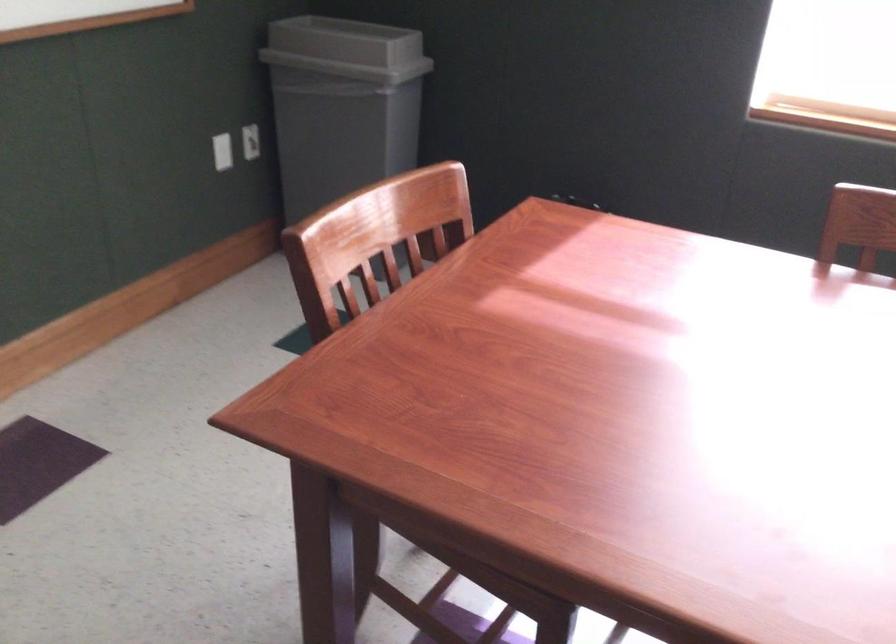
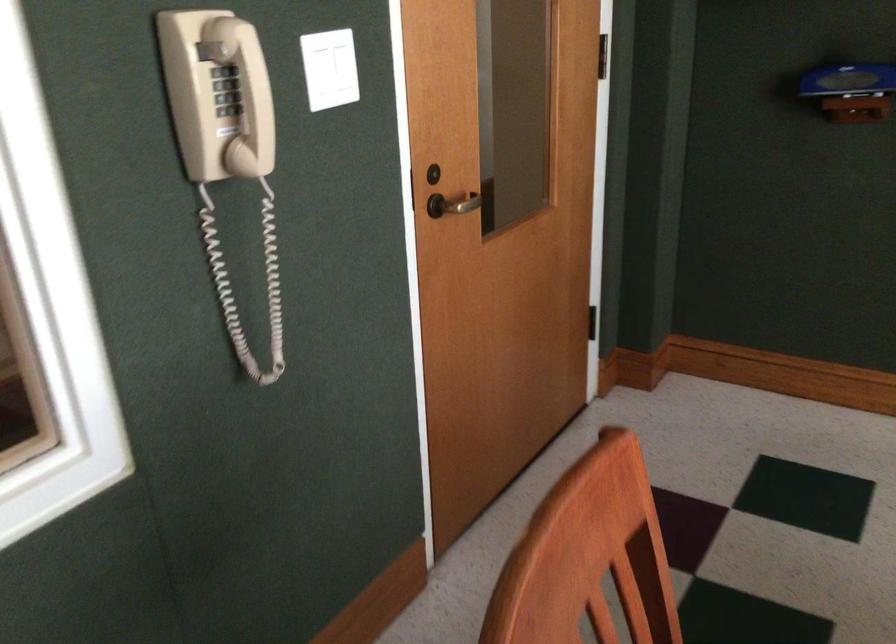
The images are taken continuously from a first-person perspective. In which direction is your viewpoint rotating?

The camera rotated toward left-down.